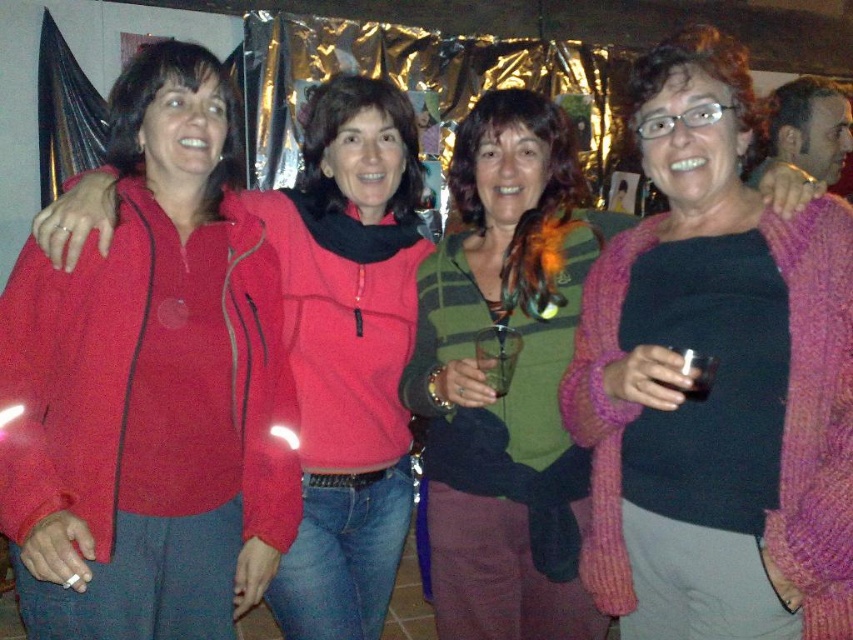
Question: Does pink knitted sweater at center appear on the left side of matte red jacket at left?

Choices:
 (A) no
 (B) yes

Answer: (A)

Question: Is pink knitted sweater at center further to camera compared to matte red jacket at left?

Choices:
 (A) no
 (B) yes

Answer: (A)

Question: Does pink knitted sweater at center have a smaller size compared to matte red jacket at left?

Choices:
 (A) yes
 (B) no

Answer: (B)

Question: Which point is closer to the camera?

Choices:
 (A) (386, 364)
 (B) (770, 349)

Answer: (B)

Question: Which point is farther to the camera?

Choices:
 (A) (399, 304)
 (B) (788, 516)

Answer: (A)